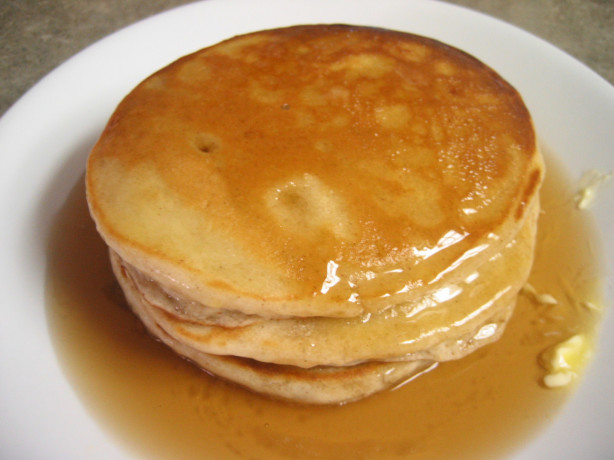
At what (x,y) coordinates should I click in order to perform the action: click on edge of plate. Please return your answer as a coordinate pair (x, y). Image resolution: width=614 pixels, height=460 pixels. Looking at the image, I should click on (589, 71), (87, 44).